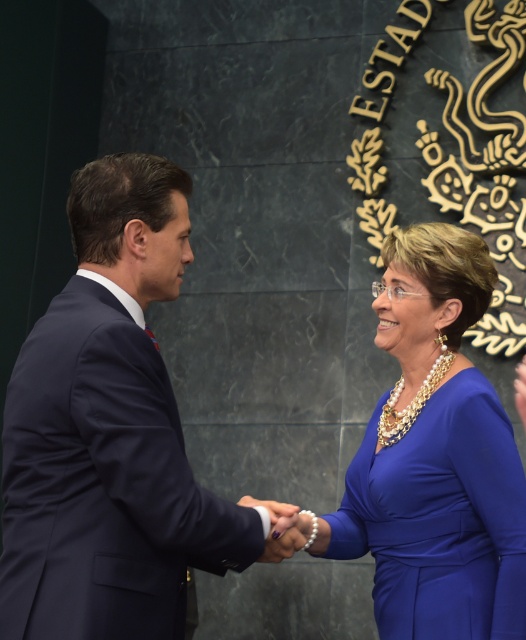
You are an event photographer at a formal event. You need to capture a photo of the navy blue suit at center and the blue satin dress at center. Which one is positioned to the left of the other?

The navy blue suit at center is to the left of the blue satin dress at center.

You are a photographer setting up for a formal event. You need to ensure that the blue satin dress at center and the smooth leather hand at center are both clearly visible in the photo. Given their sizes, which object should you focus on first to ensure proper framing?

The blue satin dress at center is larger in size than the smooth leather hand at center, so you should focus on the blue satin dress at center first to ensure proper framing since it occupies more space in the composition.